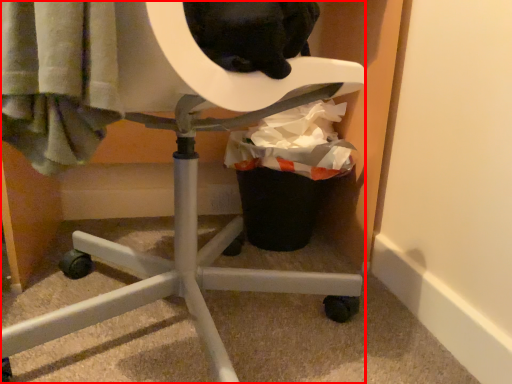
Question: From the image's perspective, what is the correct spatial positioning of furniture (annotated by the red box) in reference to garbage?

Choices:
 (A) below
 (B) above

Answer: (A)